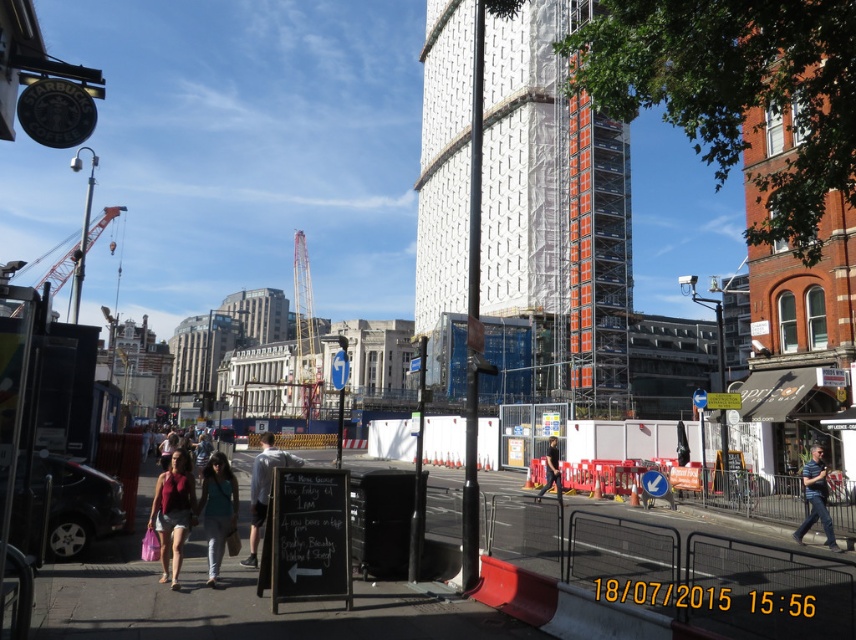
Question: Does denim pants at center appear over orange metallic crane at left?

Choices:
 (A) no
 (B) yes

Answer: (A)

Question: Which point is farther from the camera taking this photo?

Choices:
 (A) (57, 282)
 (B) (598, 188)
 (C) (230, 524)
 (D) (314, 369)

Answer: (D)

Question: Is denim pants at center to the left of black matte pants at center from the viewer's perspective?

Choices:
 (A) yes
 (B) no

Answer: (A)

Question: Which point is closer to the camera?

Choices:
 (A) white textured building at center
 (B) denim pants at center
 (C) matte red top at center

Answer: (C)

Question: Which object is the closest to the denim pants at center?

Choices:
 (A) metallic scaffolding at center
 (B) orange metallic crane at left
 (C) matte red top at center

Answer: (C)

Question: Can you confirm if metallic scaffolding at center is positioned above orange metallic crane at left?

Choices:
 (A) yes
 (B) no

Answer: (B)